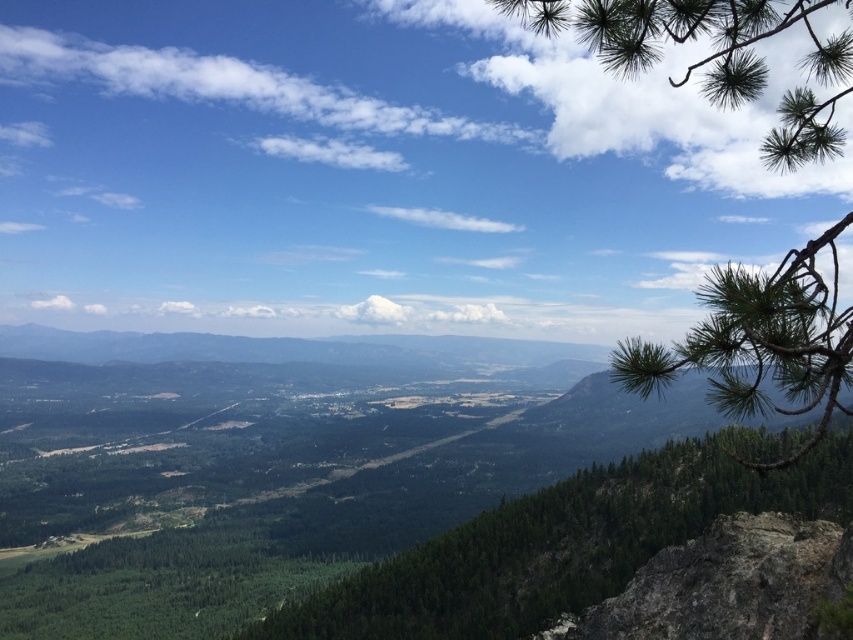
Question: Can you confirm if green textured tree at center is positioned above green needle-like branches at upper right?

Choices:
 (A) yes
 (B) no

Answer: (B)

Question: Which point appears farthest from the camera in this image?

Choices:
 (A) (764, 456)
 (B) (799, 378)

Answer: (A)

Question: Which of the following is the farthest from the observer?

Choices:
 (A) [792, 477]
 (B) [799, 115]

Answer: (A)

Question: Observing the image, what is the correct spatial positioning of green textured tree at center in reference to green needle-like branches at upper right?

Choices:
 (A) above
 (B) below

Answer: (B)

Question: Does green textured tree at center have a lesser width compared to green needle-like branches at upper right?

Choices:
 (A) no
 (B) yes

Answer: (B)